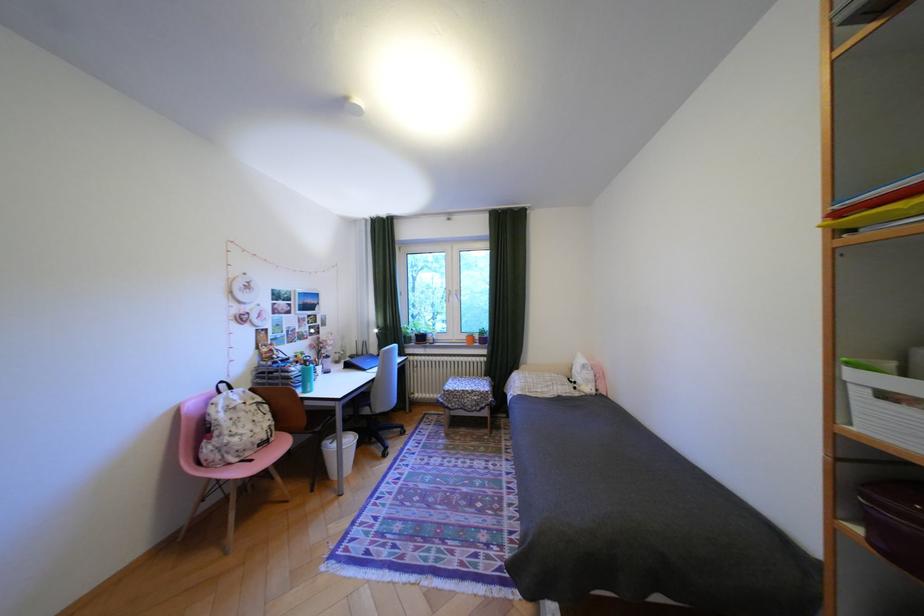
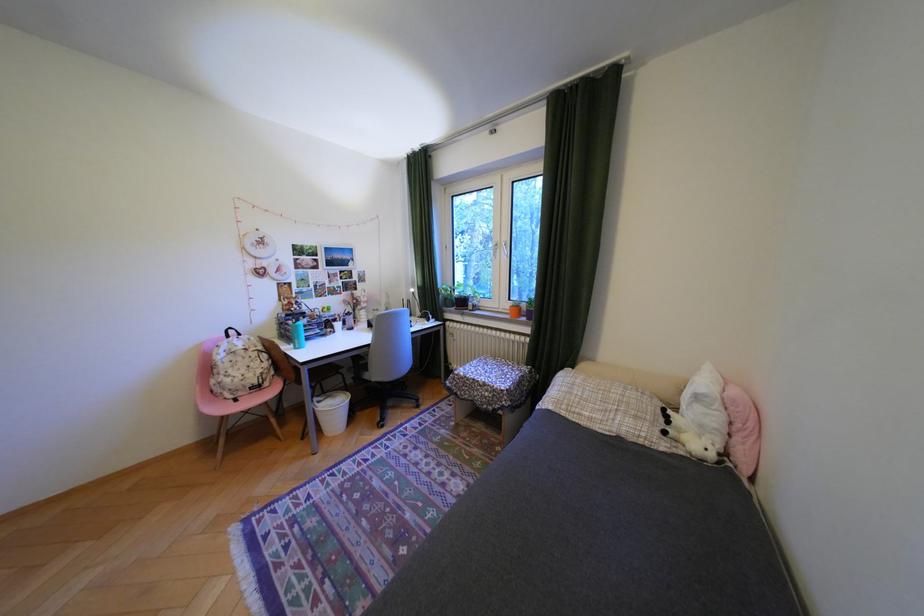
In the second image, find the point that corresponds to pixel 300 378 in the first image.

(300, 331)